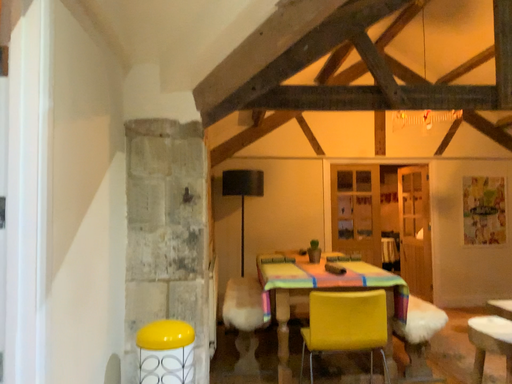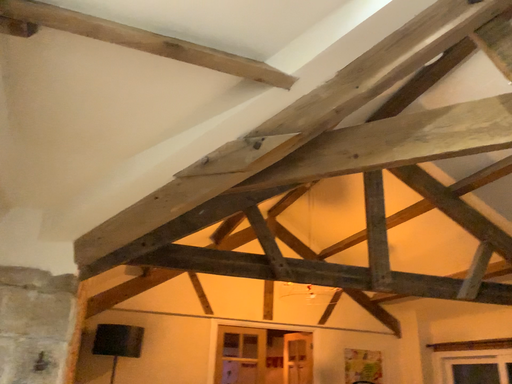
Question: Which way did the camera rotate in the video?

Choices:
 (A) rotated left
 (B) rotated right

Answer: (B)